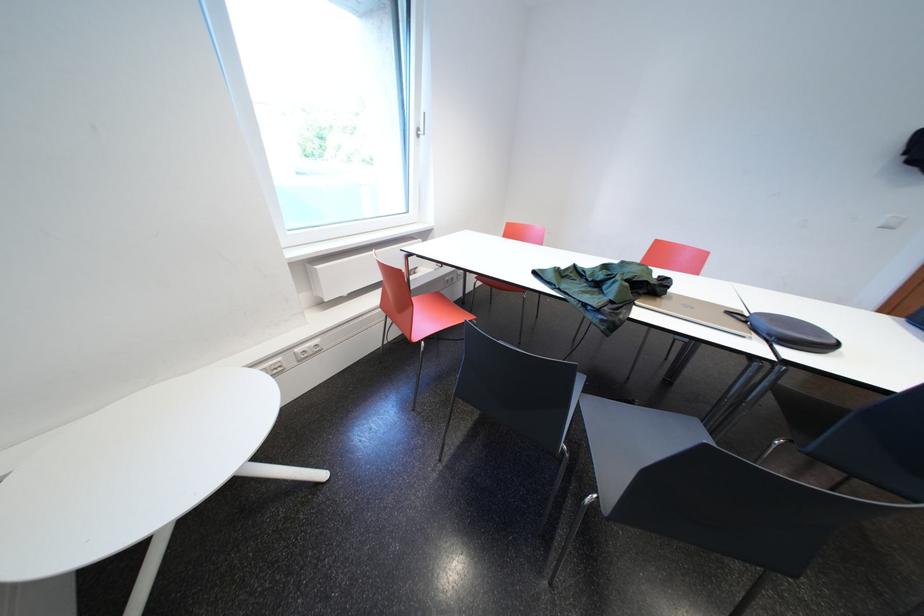
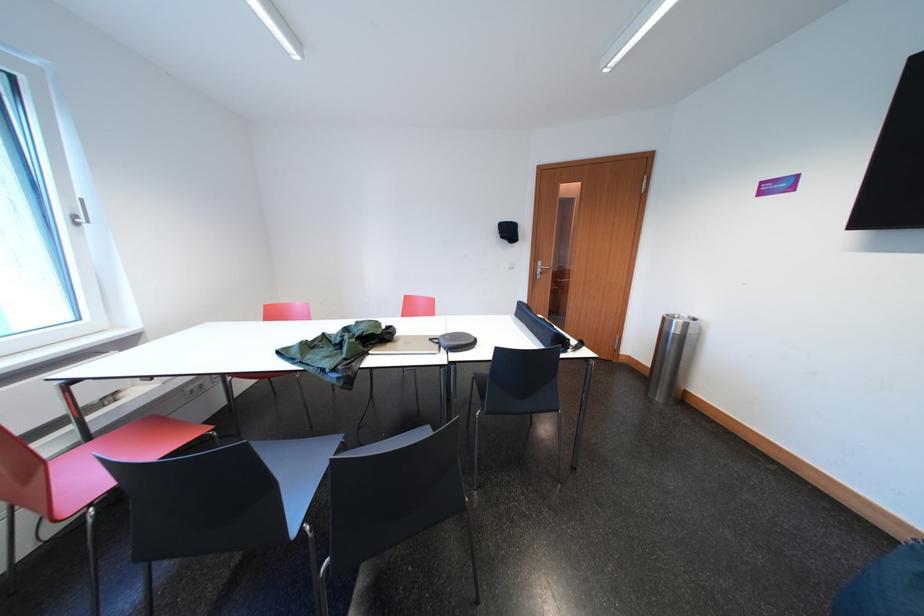
Question: Based on the continuous images, in which direction is the camera rotating? Reply with the corresponding letter.

Choices:
 (A) Left
 (B) Right
 (C) Up
 (D) Down

Answer: (B)